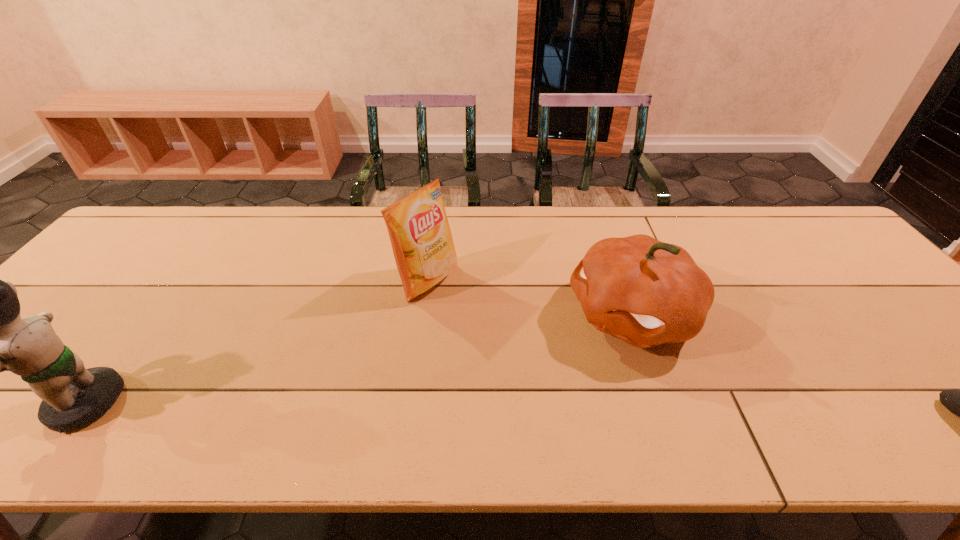
Locate an element on the screen. Image resolution: width=960 pixels, height=540 pixels. object present at the near edge is located at coordinates (72, 396).

The height and width of the screenshot is (540, 960). I want to click on free point at the far edge, so click(x=557, y=208).

You are a GUI agent. You are given a task and a screenshot of the screen. Output one action in this format:
    pyautogui.click(x=<x>, y=<y>)
    Task: Click on the vacant space at the near edge of the desktop
    This screenshot has width=960, height=540.
    Given the screenshot: What is the action you would take?
    pyautogui.click(x=383, y=404)

In the image, there is a desktop. Identify the location of free space at the left edge. The height and width of the screenshot is (540, 960). (71, 325).

In the image, there is a desktop. Where is `vacant space at the right edge`? vacant space at the right edge is located at coordinates (938, 359).

In order to click on free point between the tallest object and the third object from right to left in this screenshot , I will do `click(254, 341)`.

You are a GUI agent. You are given a task and a screenshot of the screen. Output one action in this format:
    pyautogui.click(x=<x>, y=<y>)
    Task: Click on the free space between the tallest object and the second object from left to right
    The height and width of the screenshot is (540, 960).
    Given the screenshot: What is the action you would take?
    pyautogui.click(x=254, y=341)

Where is `vacant area that lies between the second object from left to right and the leftmost object`? vacant area that lies between the second object from left to right and the leftmost object is located at coordinates (254, 341).

Identify the location of free area in between the pumpkin and the tallest object. The height and width of the screenshot is (540, 960). (356, 359).

I want to click on object that stands as the second closest to the third object from left to right, so click(959, 402).